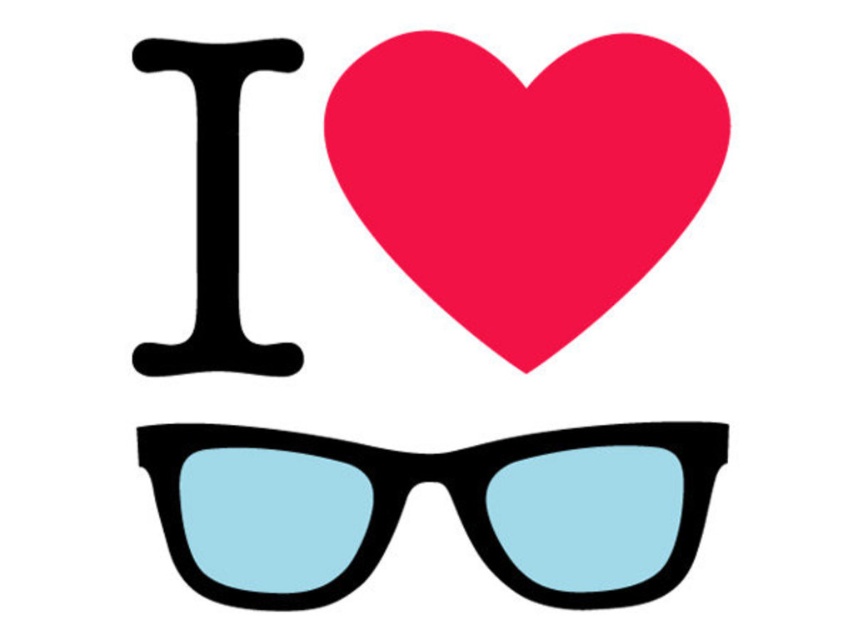
Question: Which point is farther from the camera taking this photo?

Choices:
 (A) (506, 81)
 (B) (227, 604)

Answer: (B)

Question: Which point is closer to the camera?

Choices:
 (A) (640, 67)
 (B) (405, 496)

Answer: (A)

Question: Does matte red heart at center come in front of matte black sunglasses at center?

Choices:
 (A) no
 (B) yes

Answer: (B)

Question: Is matte red heart at center wider than matte black sunglasses at center?

Choices:
 (A) no
 (B) yes

Answer: (A)

Question: Is matte red heart at center to the right of matte black sunglasses at center from the viewer's perspective?

Choices:
 (A) yes
 (B) no

Answer: (A)

Question: Among these points, which one is farthest from the camera?

Choices:
 (A) (428, 173)
 (B) (247, 595)

Answer: (B)